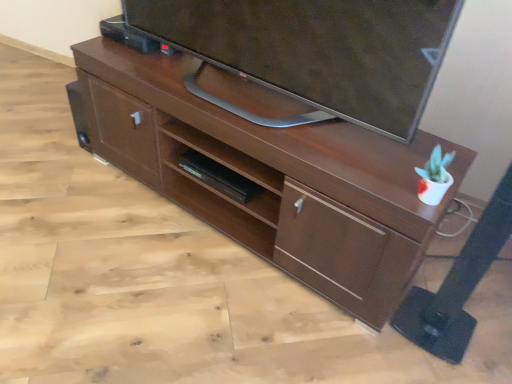
Question: Is brown wood desk at center looking in the opposite direction of matte black tv at upper center?

Choices:
 (A) no
 (B) yes

Answer: (A)

Question: From a real-world perspective, is brown wood desk at center located higher than matte black tv at upper center?

Choices:
 (A) yes
 (B) no

Answer: (B)

Question: Would you say brown wood desk at center contains matte black tv at upper center?

Choices:
 (A) yes
 (B) no

Answer: (B)

Question: Considering the relative positions of brown wood desk at center and matte black tv at upper center in the image provided, is brown wood desk at center to the right of matte black tv at upper center from the viewer's perspective?

Choices:
 (A) yes
 (B) no

Answer: (B)

Question: Is the depth of brown wood desk at center greater than that of matte black tv at upper center?

Choices:
 (A) no
 (B) yes

Answer: (B)

Question: Is matte black tv at upper center in front of or behind black matte shelf at center in the image?

Choices:
 (A) behind
 (B) front

Answer: (B)

Question: Considering the positions of matte black tv at upper center and black matte shelf at center in the image, is matte black tv at upper center bigger or smaller than black matte shelf at center?

Choices:
 (A) big
 (B) small

Answer: (A)

Question: Do you think matte black tv at upper center is within black matte shelf at center, or outside of it?

Choices:
 (A) inside
 (B) outside

Answer: (B)

Question: Considering the positions of point (312, 82) and point (168, 132), is point (312, 82) closer or farther from the camera than point (168, 132)?

Choices:
 (A) closer
 (B) farther

Answer: (A)

Question: Based on their sizes in the image, would you say brown wood desk at center is bigger or smaller than matte black tv at upper center?

Choices:
 (A) big
 (B) small

Answer: (A)

Question: Is point (190, 132) positioned closer to the camera than point (380, 8)?

Choices:
 (A) farther
 (B) closer

Answer: (A)

Question: Is brown wood desk at center situated inside matte black tv at upper center or outside?

Choices:
 (A) outside
 (B) inside

Answer: (A)

Question: Looking at their shapes, would you say brown wood desk at center is wider or thinner than matte black tv at upper center?

Choices:
 (A) wide
 (B) thin

Answer: (A)

Question: From the image's perspective, is matte black tv at upper center located above or below brown wood desk at center?

Choices:
 (A) above
 (B) below

Answer: (A)

Question: Do you think matte black tv at upper center is within brown wood desk at center, or outside of it?

Choices:
 (A) inside
 (B) outside

Answer: (B)